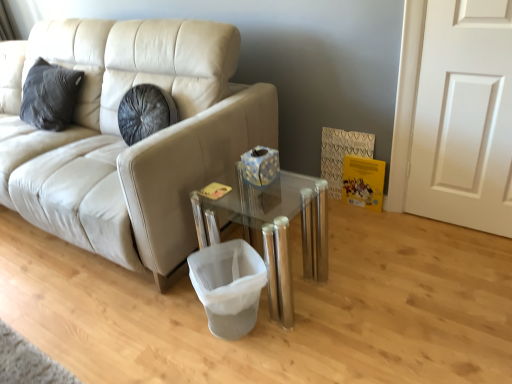
Identify the location of vacant area that lies in front of white matte door at right. The width and height of the screenshot is (512, 384). (477, 255).